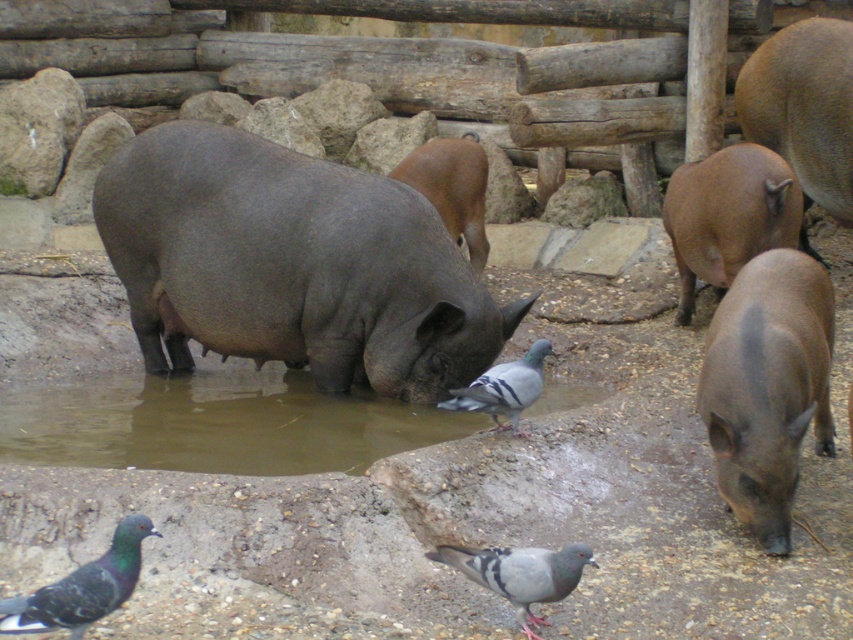
Does gray matte hippo at center have a greater width compared to brown matte pig at center?

Yes.

Who is more forward, (160, 131) or (485, 237)?

Point (160, 131) is in front.

Image resolution: width=853 pixels, height=640 pixels. Describe the element at coordinates (291, 264) in the screenshot. I see `gray matte hippo at center` at that location.

Identify the location of gray matte hippo at center. (291, 264).

Which is in front, point (331, 193) or point (747, 381)?

Point (747, 381) is in front.

Is point (283, 148) behind point (801, 276)?

Yes, it is.

Does point (285, 177) come in front of point (759, 506)?

No.

You are a GUI agent. You are given a task and a screenshot of the screen. Output one action in this format:
    pyautogui.click(x=<x>, y=<y>)
    Task: Click on the gray matte hippo at center
    This screenshot has width=853, height=640.
    Given the screenshot: What is the action you would take?
    pyautogui.click(x=291, y=264)

Does point (65, 616) come closer to viewer compared to point (525, 588)?

Yes, it is in front of point (525, 588).

Can you confirm if gray speckled pigeon at lower left is bigger than gray matte pigeon at lower center?

Incorrect, gray speckled pigeon at lower left is not larger than gray matte pigeon at lower center.

Does point (108, 580) come in front of point (529, 596)?

Yes, point (108, 580) is closer to viewer.

Image resolution: width=853 pixels, height=640 pixels. In order to click on gray speckled pigeon at lower left in this screenshot , I will do `click(82, 588)`.